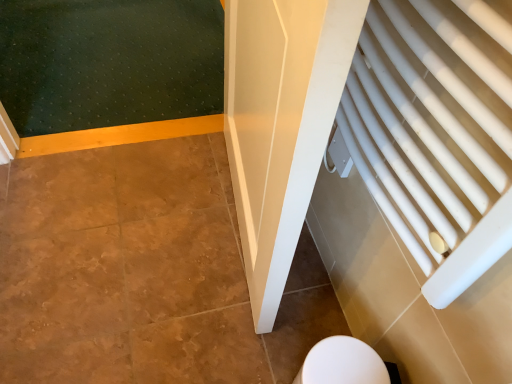
The image size is (512, 384). What do you see at coordinates (436, 133) in the screenshot?
I see `white plastic radiator at right` at bounding box center [436, 133].

Find the location of a particular element. white plastic radiator at right is located at coordinates (436, 133).

Find the location of a particular element. The height and width of the screenshot is (384, 512). white glossy toilet at lower center is located at coordinates (345, 364).

Describe the element at coordinates (345, 364) in the screenshot. I see `white glossy toilet at lower center` at that location.

Where is `white plastic radiator at right`? The width and height of the screenshot is (512, 384). white plastic radiator at right is located at coordinates (436, 133).

Which is more to the left, white glossy toilet at lower center or white plastic radiator at right?

white glossy toilet at lower center.

Does white glossy toilet at lower center lie behind white plastic radiator at right?

Yes, it is behind white plastic radiator at right.

Does point (376, 353) appear closer or farther from the camera than point (498, 152)?

Point (376, 353).

From the image's perspective, is white glossy toilet at lower center above or below white plastic radiator at right?

Clearly, from the image's perspective, white glossy toilet at lower center is below white plastic radiator at right.

From a real-world perspective, who is located lower, white glossy toilet at lower center or white plastic radiator at right?

white glossy toilet at lower center, from a real-world perspective.

Which of these two, white glossy toilet at lower center or white plastic radiator at right, is wider?

white glossy toilet at lower center.

In terms of height, does white glossy toilet at lower center look taller or shorter compared to white plastic radiator at right?

In the image, white glossy toilet at lower center appears to be shorter than white plastic radiator at right.

Who is smaller, white glossy toilet at lower center or white plastic radiator at right?

Smaller between the two is white glossy toilet at lower center.

Is white glossy toilet at lower center inside the boundaries of white plastic radiator at right, or outside?

white glossy toilet at lower center is outside white plastic radiator at right.

Would you say white glossy toilet at lower center is a long distance from white plastic radiator at right?

They are positioned close to each other.

Is white glossy toilet at lower center oriented away from white plastic radiator at right?

That's not correct — white glossy toilet at lower center is not looking away from white plastic radiator at right.

How different are the orientations of white glossy toilet at lower center and white plastic radiator at right in degrees?

The facing directions of white glossy toilet at lower center and white plastic radiator at right are 1.28 degrees apart.

Where is `curtain in front of the white glossy toilet at lower center`? Image resolution: width=512 pixels, height=384 pixels. curtain in front of the white glossy toilet at lower center is located at coordinates (436, 133).

Considering the positions of objects white plastic radiator at right and white glossy toilet at lower center in the image provided, who is more to the left, white plastic radiator at right or white glossy toilet at lower center?

Positioned to the left is white glossy toilet at lower center.

Which object is closer to the camera, white plastic radiator at right or white glossy toilet at lower center?

white plastic radiator at right is closer to the camera.

Is point (483, 240) closer or farther from the camera than point (337, 351)?

Clearly, point (483, 240) is closer to the camera than point (337, 351).

From the image's perspective, relative to white glossy toilet at lower center, is white plastic radiator at right above or below?

white plastic radiator at right is situated higher than white glossy toilet at lower center in the image.

From a real-world perspective, is white plastic radiator at right on white glossy toilet at lower center?

Correct, in the physical world, white plastic radiator at right is higher than white glossy toilet at lower center.

Which object is wider, white plastic radiator at right or white glossy toilet at lower center?

Wider between the two is white glossy toilet at lower center.

Can you confirm if white plastic radiator at right is taller than white glossy toilet at lower center?

Correct, white plastic radiator at right is much taller as white glossy toilet at lower center.

Is white plastic radiator at right bigger or smaller than white glossy toilet at lower center?

In the image, white plastic radiator at right appears to be larger than white glossy toilet at lower center.

Is white plastic radiator at right inside the boundaries of white glossy toilet at lower center, or outside?

white plastic radiator at right is not enclosed by white glossy toilet at lower center.

Is white plastic radiator at right not near white glossy toilet at lower center?

No, white plastic radiator at right is not far from white glossy toilet at lower center.

Is white plastic radiator at right turned away from white glossy toilet at lower center?

No, white glossy toilet at lower center is not at the back of white plastic radiator at right.

Can you tell me how much white plastic radiator at right and white glossy toilet at lower center differ in facing direction?

There is a 1.28-degree angle between the facing directions of white plastic radiator at right and white glossy toilet at lower center.

Where is `curtain in front of the white glossy toilet at lower center`? Image resolution: width=512 pixels, height=384 pixels. curtain in front of the white glossy toilet at lower center is located at coordinates (436, 133).

Locate an element on the screen. curtain above the white glossy toilet at lower center (from a real-world perspective) is located at coordinates (436, 133).

Find the location of a particular element. curtain above the white glossy toilet at lower center (from the image's perspective) is located at coordinates (436, 133).